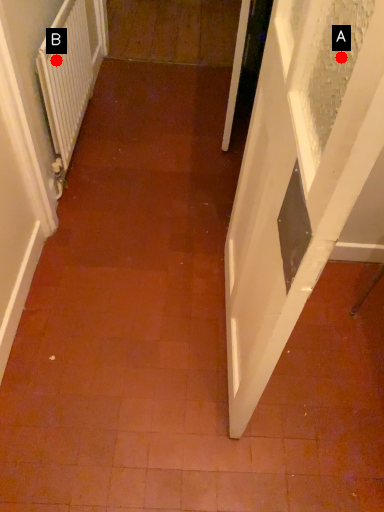
Question: Two points are circled on the image, labeled by A and B beside each circle. Which point is further to the camera?

Choices:
 (A) A is further
 (B) B is further

Answer: (B)